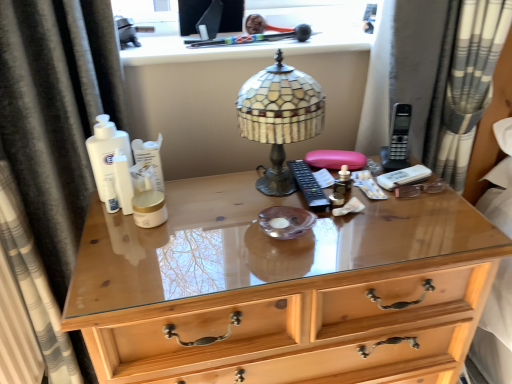
Question: Is stained glass lampshade at center wider or thinner than wooden chest of drawers at center?

Choices:
 (A) wide
 (B) thin

Answer: (B)

Question: From the image's perspective, relative to wooden chest of drawers at center, is stained glass lampshade at center above or below?

Choices:
 (A) above
 (B) below

Answer: (A)

Question: Which is farther from the wooden chest of drawers at center?

Choices:
 (A) gold matte jar at center, acting as the 1th toiletry starting from the bottom
 (B) gray striped curtain at right, which is counted as the first curtain, starting from the right
 (C) white matte lotion at center, the second toiletry in the front-to-back sequence
 (D) stained glass lampshade at center
 (E) black fabric curtain at left, which is counted as the 2th curtain, starting from the right

Answer: (B)

Question: Considering the real-world distances, which object is closest to the white matte lotion at center, the second toiletry in the front-to-back sequence?

Choices:
 (A) black fabric curtain at left, which appears as the first curtain when viewed from the left
 (B) wooden chest of drawers at center
 (C) gray striped curtain at right, which is counted as the first curtain, starting from the right
 (D) stained glass lampshade at center
 (E) gold matte jar at center, acting as the 2th toiletry starting from the back

Answer: (E)